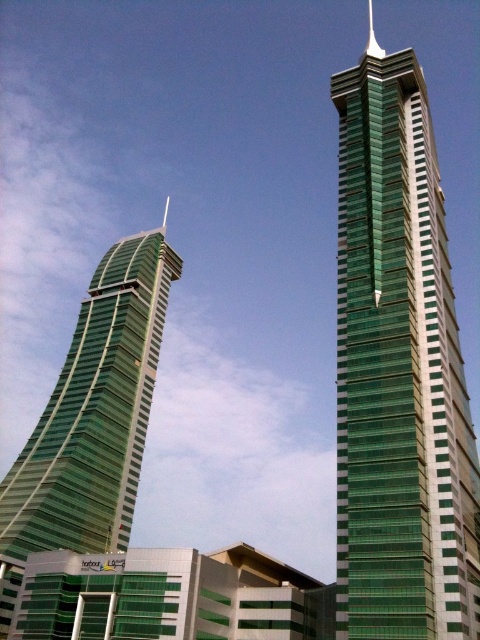
Who is taller, green glass tower at center or green glass spire at upper center?

Standing taller between the two is green glass spire at upper center.

Between green glass tower at center and green glass spire at upper center, which one appears on the right side from the viewer's perspective?

Positioned to the right is green glass spire at upper center.

This screenshot has width=480, height=640. I want to click on green glass tower at center, so click(398, 372).

The height and width of the screenshot is (640, 480). What are the coordinates of `green glass tower at center` in the screenshot? It's located at (398, 372).

Can you confirm if green glass tower at left is shorter than green glass spire at upper center?

Indeed, green glass tower at left has a lesser height compared to green glass spire at upper center.

Does green glass tower at left come in front of green glass spire at upper center?

Yes, it is.

Between point (149, 304) and point (371, 36), which one is positioned in front?

Point (149, 304)

Locate an element on the screen. The width and height of the screenshot is (480, 640). green glass tower at left is located at coordinates (92, 419).

Which is more to the left, green glass tower at center or green glass tower at left?

Positioned to the left is green glass tower at left.

Where is `green glass tower at center`? green glass tower at center is located at coordinates (398, 372).

The width and height of the screenshot is (480, 640). I want to click on green glass tower at center, so click(398, 372).